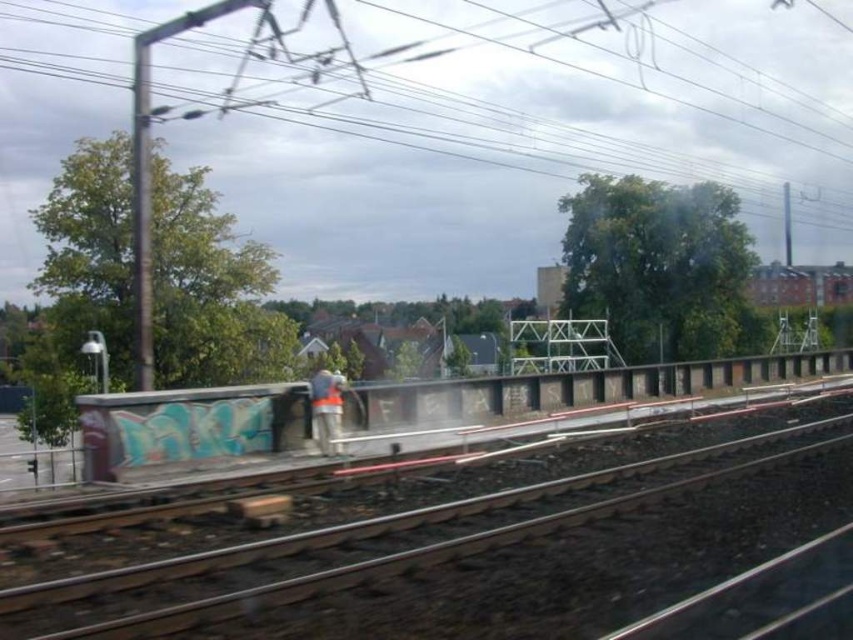
Question: Which point is closer to the camera taking this photo?

Choices:
 (A) (328, 396)
 (B) (12, 586)

Answer: (B)

Question: Where is metallic wire at upper center located in relation to metal track at center in the image?

Choices:
 (A) below
 (B) above

Answer: (B)

Question: Is metallic wire at upper center above metal track at center?

Choices:
 (A) no
 (B) yes

Answer: (B)

Question: Which point is closer to the camera?

Choices:
 (A) metallic wire at upper center
 (B) metal track at center

Answer: (B)

Question: Which object is positioned farthest from the metal track at center?

Choices:
 (A) orange reflective vest at center
 (B) metallic wire at upper center

Answer: (B)

Question: Can you confirm if metallic wire at upper center is thinner than orange reflective vest at center?

Choices:
 (A) no
 (B) yes

Answer: (A)